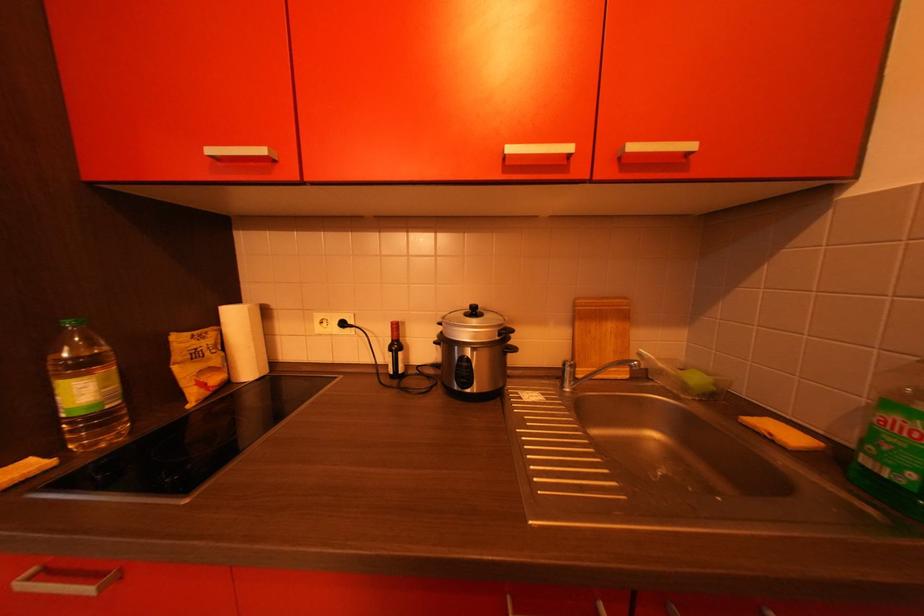
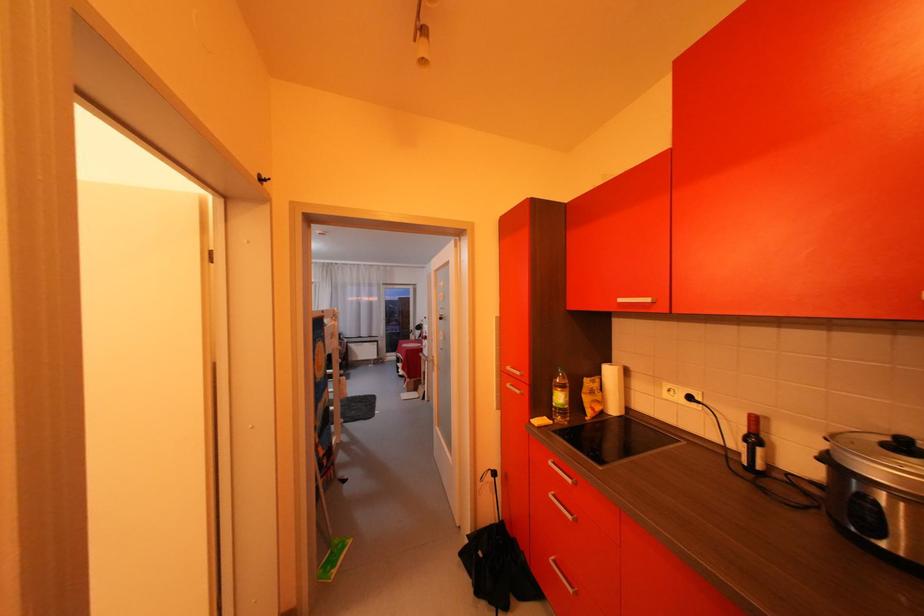
Locate, in the second image, the point that corresponds to (214,339) in the first image.

(605, 383)